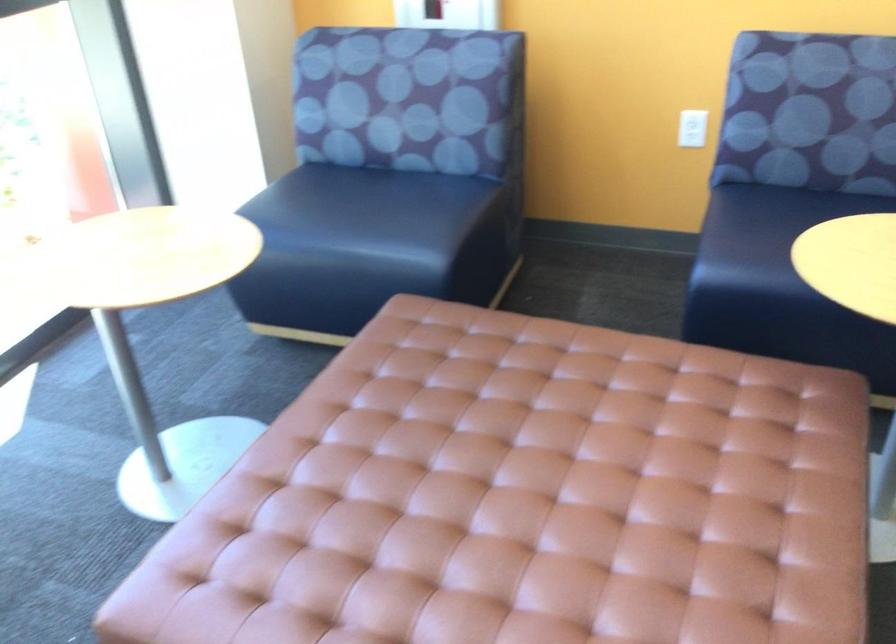
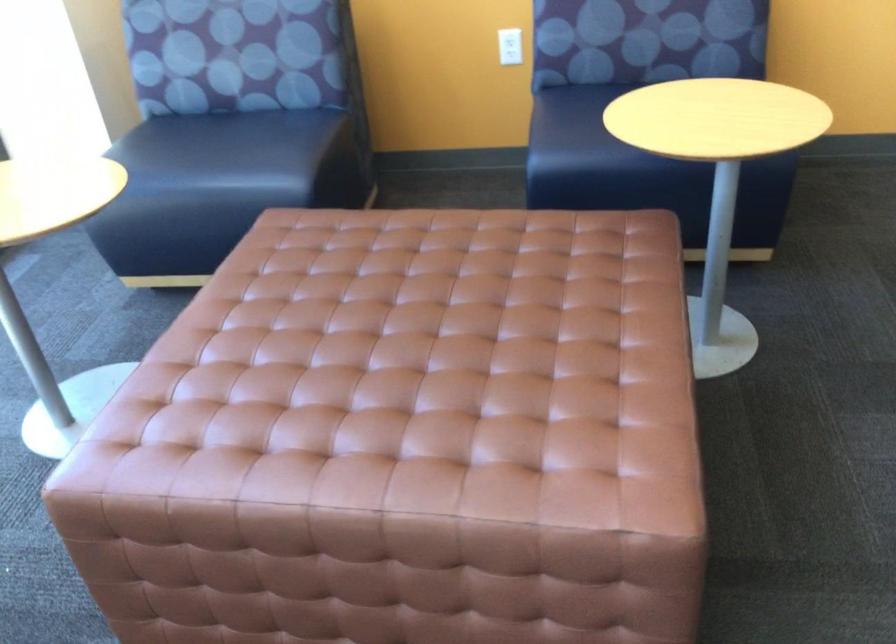
Question: Based on the continuous images, in which direction is the camera rotating? Reply with the corresponding letter.

Choices:
 (A) Left
 (B) Right
 (C) Up
 (D) Down

Answer: (B)